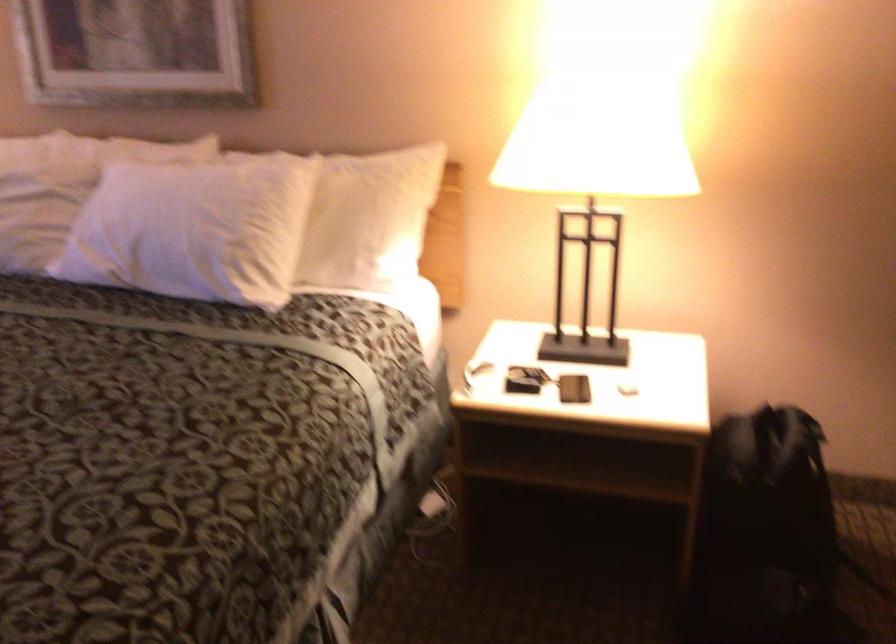
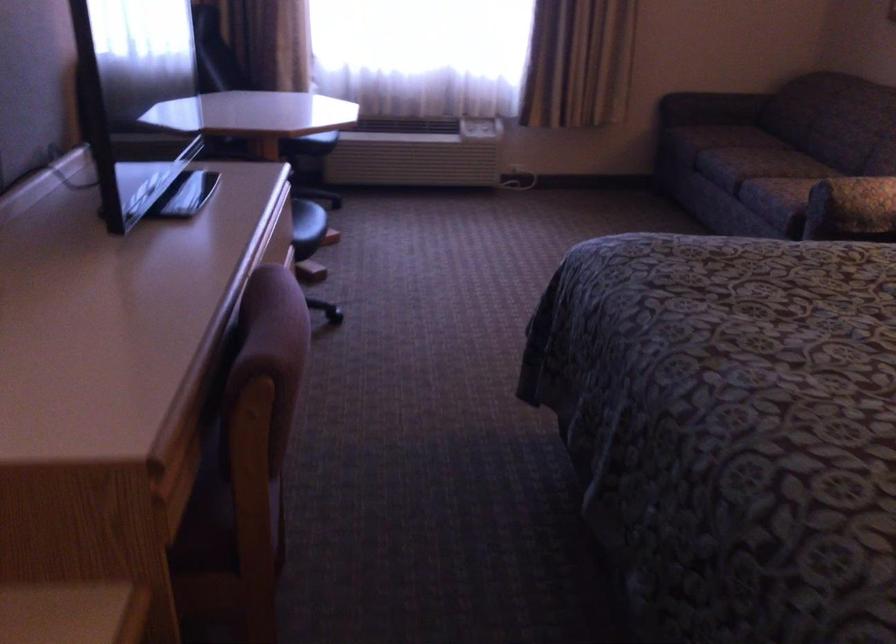
First-person continuous shooting, in which direction is the camera rotating?

The rotation direction of the camera is left-down.